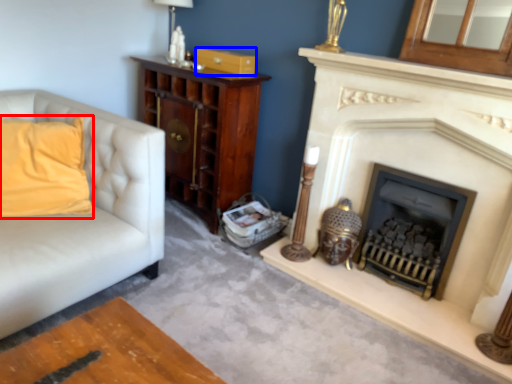
Question: Which point is further to the camera, pillow (highlighted by a red box) or drawer (highlighted by a blue box)?

Choices:
 (A) pillow
 (B) drawer

Answer: (B)